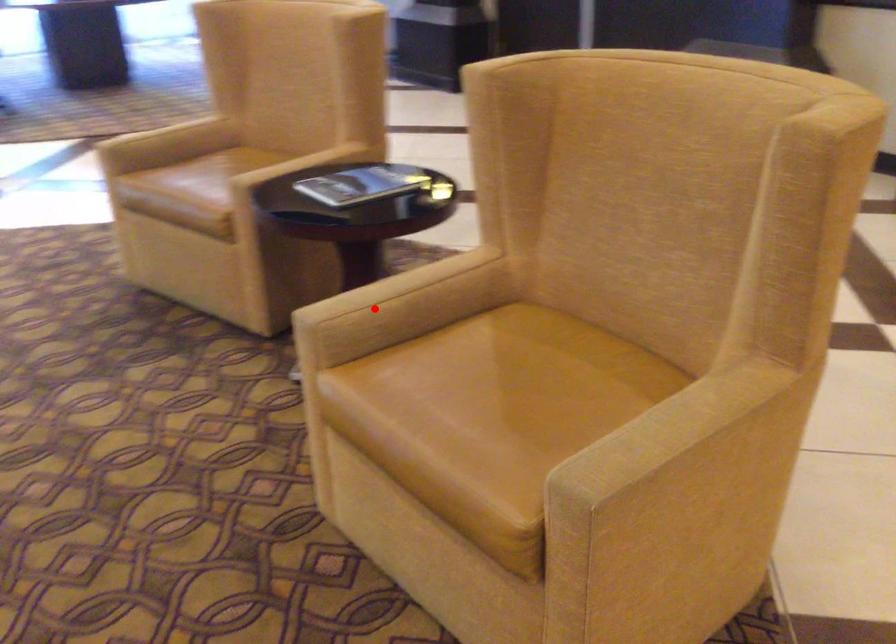
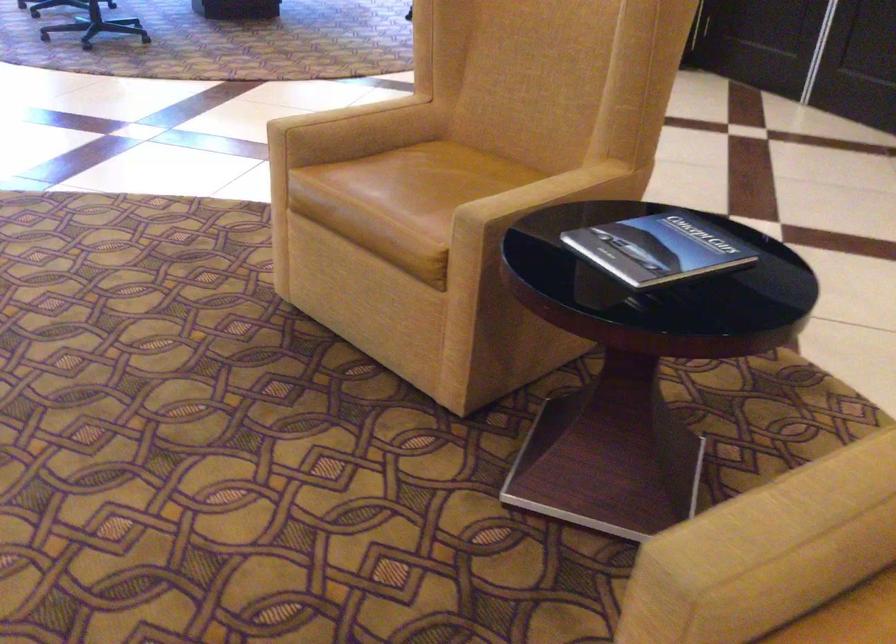
Question: I am providing you with two images of the same scene from different viewpoints. Image1 has a red point marked. In image2, the corresponding 3D location appears at what relative position? Reply with the corresponding letter.

Choices:
 (A) Closer
 (B) Farther

Answer: (A)